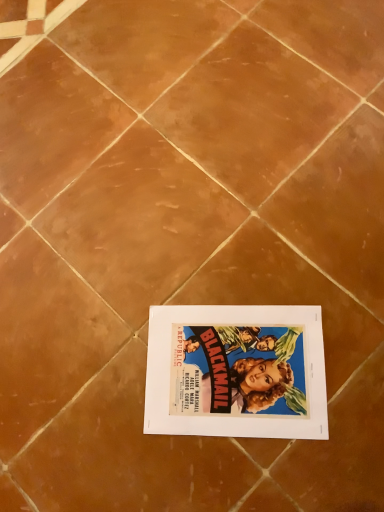
Identify the location of blank space above white paper at center (from a real-world perspective). This screenshot has width=384, height=512. (227, 369).